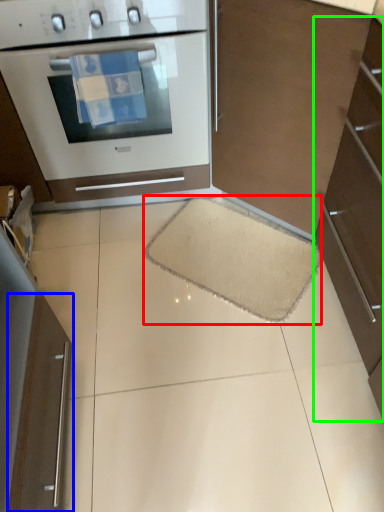
Question: Which is nearer to the doormat (highlighted by a red box)? appliance (highlighted by a blue box) or cabinetry (highlighted by a green box).

Choices:
 (A) appliance
 (B) cabinetry

Answer: (B)